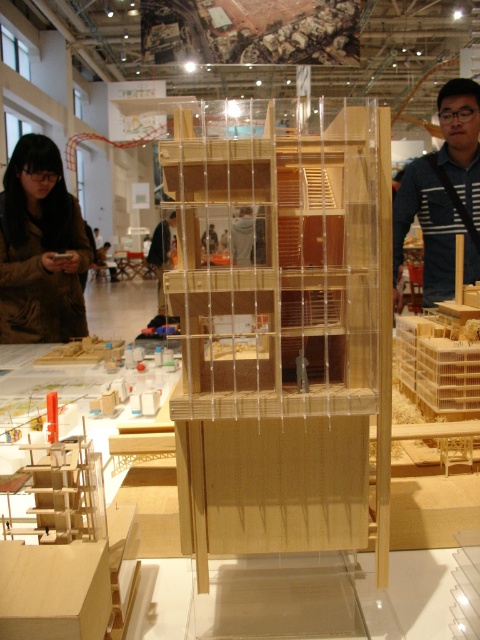
Question: Can you confirm if wooden cage at center is positioned to the left of brown leather jacket at lower left?

Choices:
 (A) yes
 (B) no

Answer: (B)

Question: Based on their relative distances, which object is farther from the wooden figure at center?

Choices:
 (A) brown leather jacket at lower left
 (B) blue striped shirt at upper right
 (C) wooden cage at center

Answer: (C)

Question: Which point is closer to the camera?

Choices:
 (A) [x=436, y=243]
 (B) [x=29, y=330]
 (C) [x=216, y=198]

Answer: (C)

Question: From the image, what is the correct spatial relationship of blue striped shirt at upper right in relation to wooden figure at center?

Choices:
 (A) left
 (B) right

Answer: (B)

Question: Which point is closer to the camera?

Choices:
 (A) (374, 211)
 (B) (169, 227)

Answer: (A)

Question: Where is wooden cage at center located in relation to blue striped shirt at upper right in the image?

Choices:
 (A) above
 (B) below

Answer: (B)